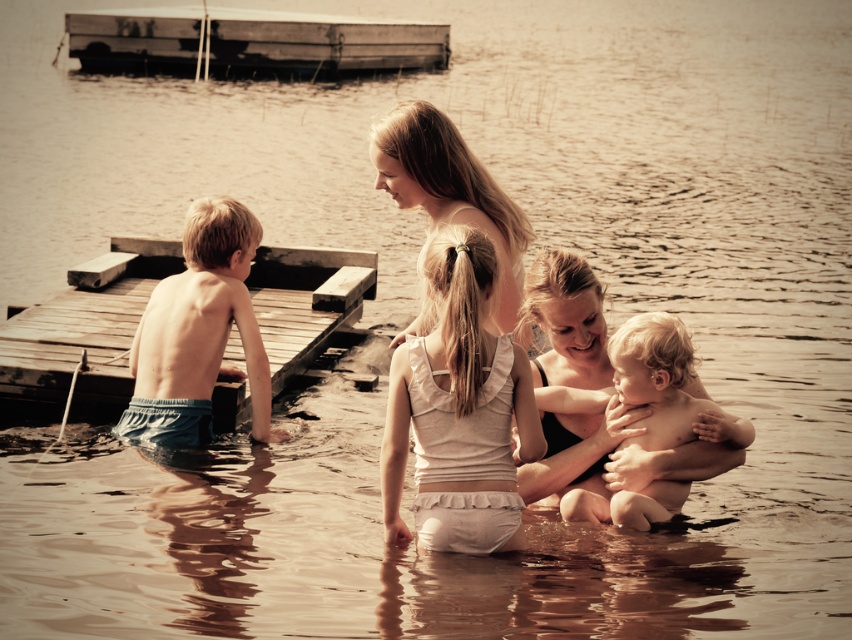
Which is more to the right, blue denim shorts at left or wooden raft at upper left?

blue denim shorts at left is more to the right.

Does blue denim shorts at left have a greater width compared to wooden raft at upper left?

No.

Between point (174, 304) and point (436, 33), which one is positioned behind?

Positioned behind is point (436, 33).

Locate an element on the screen. This screenshot has height=640, width=852. blue denim shorts at left is located at coordinates (199, 333).

Does blue denim shorts at left have a lesser height compared to smooth skin woman at center?

In fact, blue denim shorts at left may be taller than smooth skin woman at center.

Where is `blue denim shorts at left`? This screenshot has height=640, width=852. blue denim shorts at left is located at coordinates (199, 333).

The height and width of the screenshot is (640, 852). I want to click on blue denim shorts at left, so click(x=199, y=333).

Can you confirm if white cotton tank top at center is positioned below wooden raft at upper left?

Yes.

From the picture: Which is more to the left, white cotton tank top at center or wooden raft at upper left?

Positioned to the left is wooden raft at upper left.

Who is more distant from viewer, (465, 301) or (396, 29)?

The point (396, 29) is more distant.

Where is `white cotton tank top at center`? This screenshot has width=852, height=640. white cotton tank top at center is located at coordinates (459, 406).